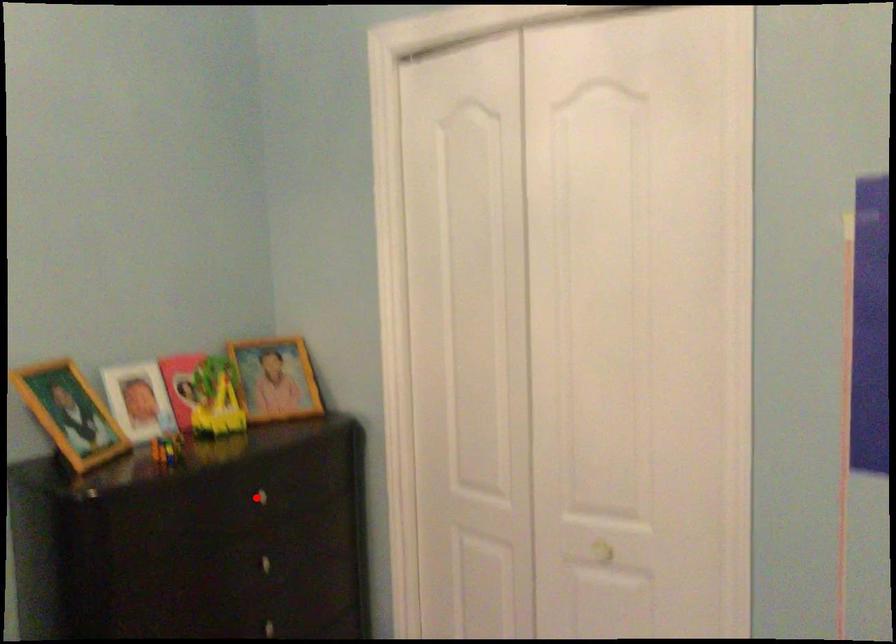
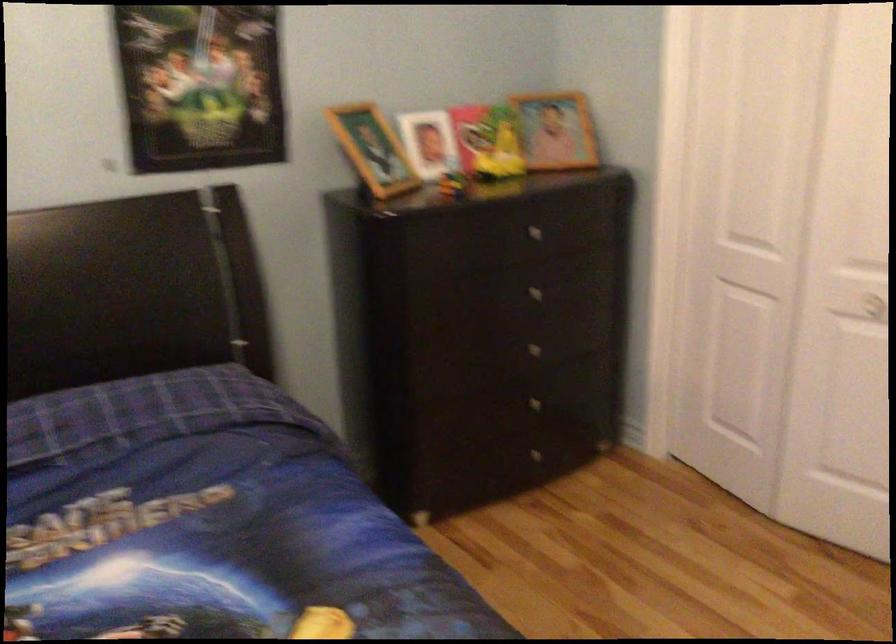
The point at the highlighted location is marked in the first image. Where is the corresponding point in the second image?

(530, 230)